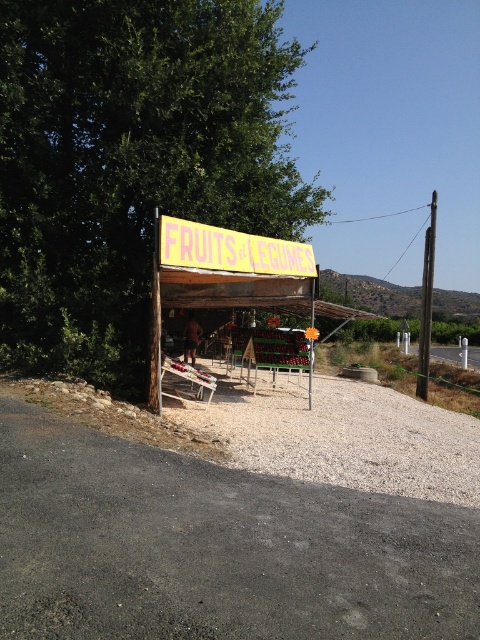
You are a customer approaching the fruit and vegetable stand. You notice the green leafy tree at upper left and the gray gravel at lower center. Which of these two objects appears wider in the image?

The green leafy tree at upper left appears wider than the gray gravel at lower center because its width surpasses that of the gray gravel at lower center.

You are standing in front of the fruit and vegetable stand and want to know which of the two points, point [248,541] or point [442,458], is closer to you. Can you determine this based on the image?

Point [248,541] is closer to the camera than point [442,458], so it is closer to you.

From the picture: You are a customer carrying a heavy basket and need to reach the gray gravel at lower center from the green leafy tree at upper left. The path is straight. Can you walk directly to the gravel without any obstacles?

The distance between the green leafy tree at upper left and gray gravel at lower center is 5.90 meters, so yes, you can walk directly to the gray gravel at lower center without any obstacles as there is a straight path.